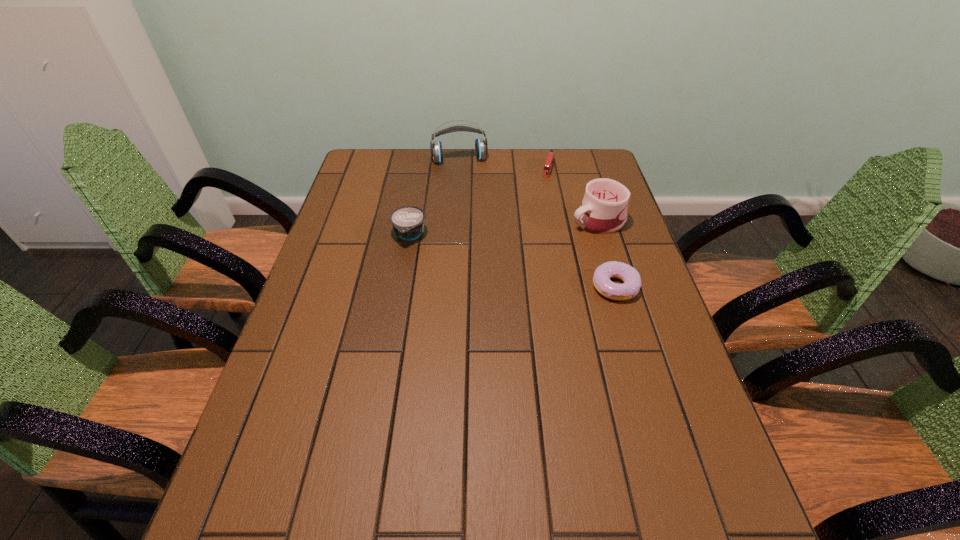
The width and height of the screenshot is (960, 540). I want to click on blank space at the far edge, so click(x=496, y=181).

Where is `blank area at the near edge`? blank area at the near edge is located at coordinates (619, 476).

You are a GUI agent. You are given a task and a screenshot of the screen. Output one action in this format:
    pyautogui.click(x=<x>, y=<y>)
    Task: Click on the vacant area at the left edge
    The height and width of the screenshot is (540, 960).
    Given the screenshot: What is the action you would take?
    pyautogui.click(x=350, y=279)

Where is `vacant space at the right edge of the desktop`? vacant space at the right edge of the desktop is located at coordinates (686, 382).

You are a GUI agent. You are given a task and a screenshot of the screen. Output one action in this format:
    pyautogui.click(x=<x>, y=<y>)
    Task: Click on the free location at the far left corner
    
    Given the screenshot: What is the action you would take?
    (x=382, y=158)

The height and width of the screenshot is (540, 960). In order to click on vacant space at the far right corner of the desktop in this screenshot , I will do `click(592, 151)`.

The height and width of the screenshot is (540, 960). In order to click on free space between the third object from left to right and the mug in this screenshot , I will do `click(573, 194)`.

This screenshot has width=960, height=540. Identify the location of free space between the third shortest object and the mug. (504, 228).

At what (x,y) coordinates should I click in order to perform the action: click on free spot between the doughnut and the second tallest object. Please return your answer as a coordinate pair (x, y). Looking at the image, I should click on (607, 253).

Identify the location of free spot between the doughnut and the second tallest object. [x=607, y=253].